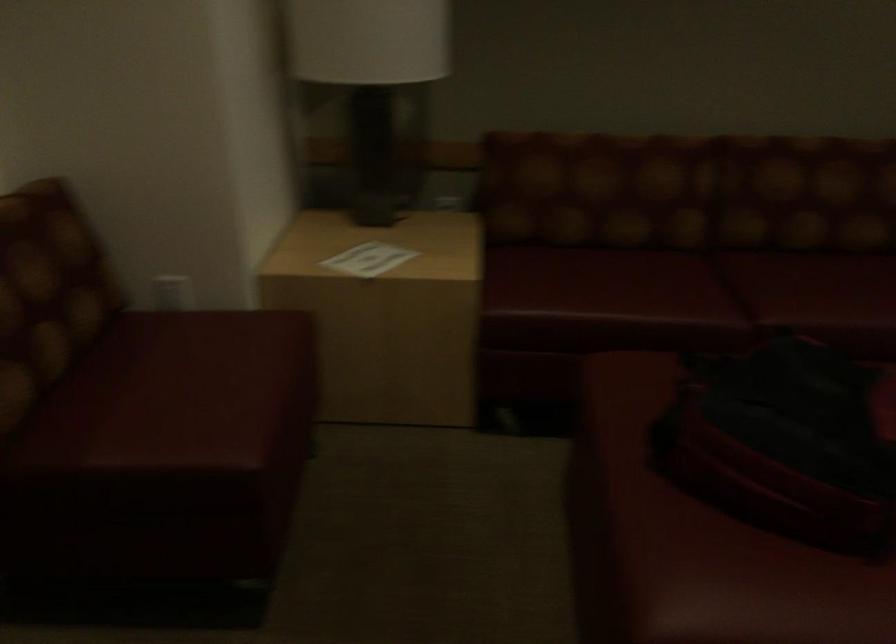
The image size is (896, 644). What do you see at coordinates (693, 541) in the screenshot? I see `the ottoman sitting surface` at bounding box center [693, 541].